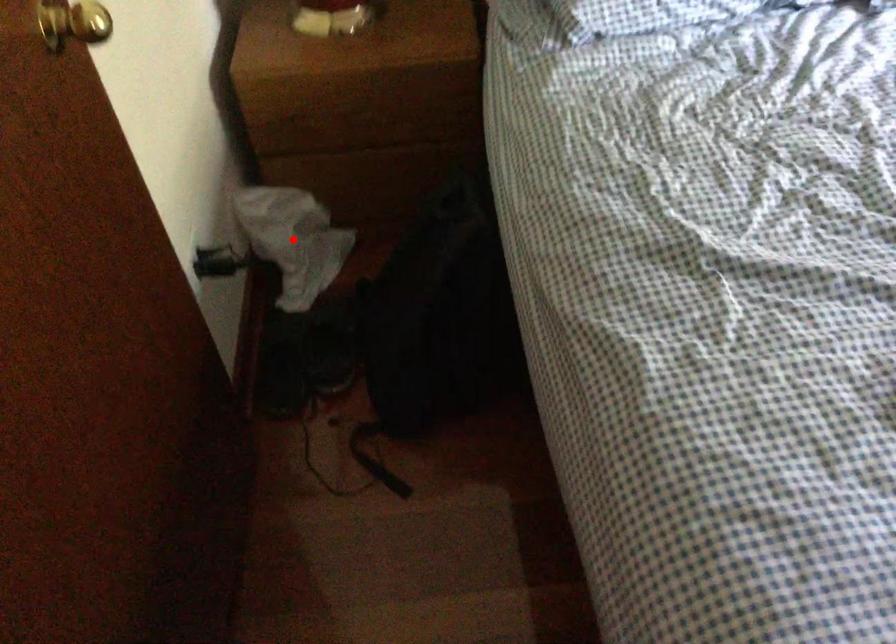
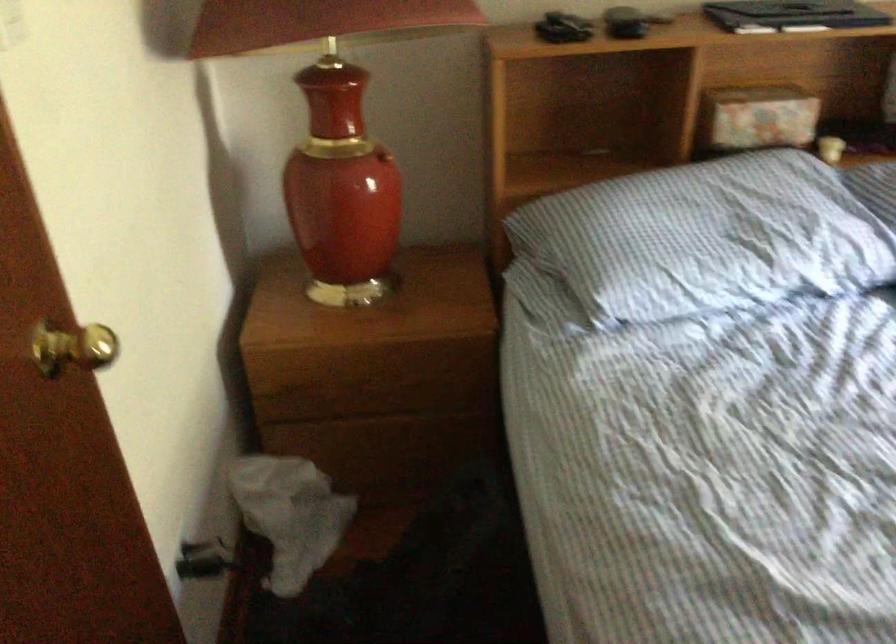
Find the pixel in the second image that matches the highlighted location in the first image.

(289, 515)